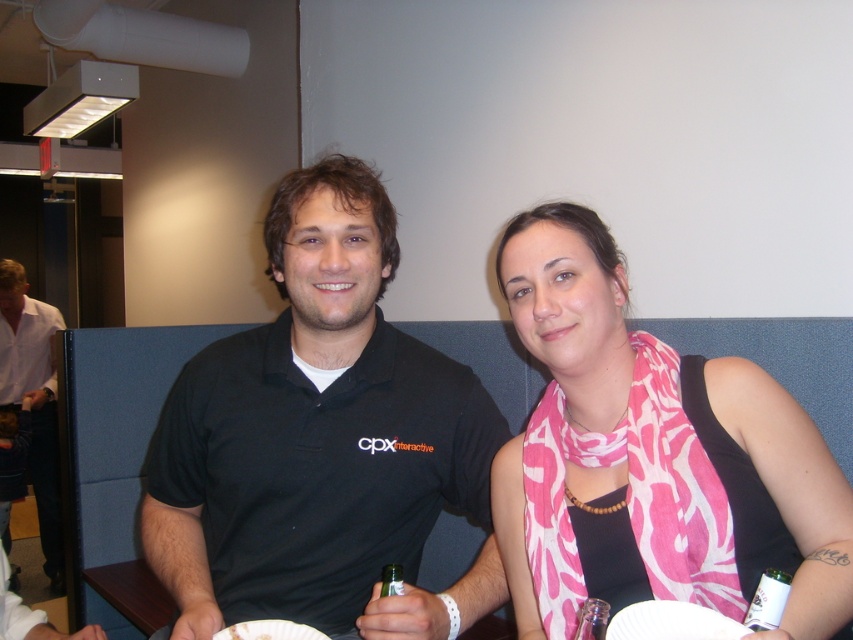
You are a photographer setting up for an event. You need to position a light so it illuminates both the black polo shirt at center and the white shirt at left equally. Considering their heights, which shirt should the light be angled towards?

The black polo shirt at center is shorter than the white shirt at left, so the light should be angled towards the white shirt at left to ensure both receive equal illumination.

You are a photographer at a casual event. You notice the pink printed scarf at center and the white shirt at left in your frame. Which object is covering part of the other?

The pink printed scarf at center is positioned over the white shirt at left, so it is covering part of the white shirt at left.